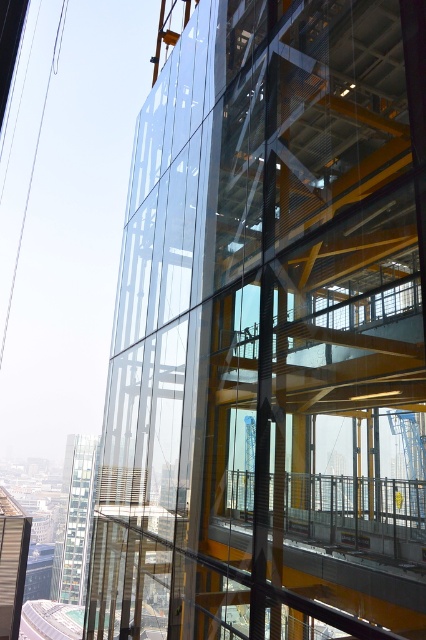
Does glassy transparent tower at lower left have a smaller size compared to metallic glass tower at center?

Actually, glassy transparent tower at lower left might be larger than metallic glass tower at center.

Can you confirm if glassy transparent tower at lower left is bigger than metallic glass tower at center?

Indeed, glassy transparent tower at lower left has a larger size compared to metallic glass tower at center.

The height and width of the screenshot is (640, 426). In order to click on glassy transparent tower at lower left in this screenshot , I will do `click(74, 518)`.